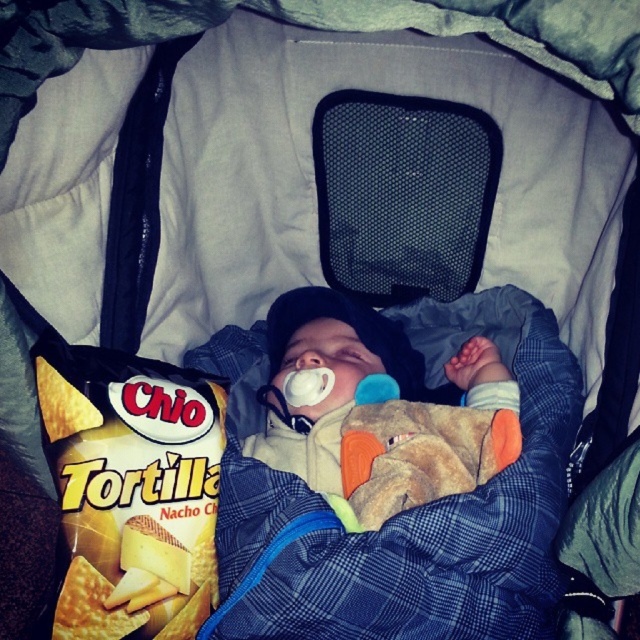
Which is behind, point (93, 484) or point (412, 433)?

Point (412, 433)

Measure the distance from yellow tortilla chips at lower left to blue rubber teething ring at upper center.

yellow tortilla chips at lower left is 13.68 inches away from blue rubber teething ring at upper center.

This screenshot has height=640, width=640. What do you see at coordinates (132, 490) in the screenshot?
I see `yellow tortilla chips at lower left` at bounding box center [132, 490].

Locate an element on the screen. yellow tortilla chips at lower left is located at coordinates (132, 490).

Can you confirm if soft plush toy at center is positioned to the left of blue rubber teething ring at upper center?

Yes, soft plush toy at center is to the left of blue rubber teething ring at upper center.

Consider the image. Is soft plush toy at center above blue rubber teething ring at upper center?

Yes.

Does point (506, 413) come closer to viewer compared to point (390, 448)?

Yes, it is in front of point (390, 448).

This screenshot has width=640, height=640. What are the coordinates of `soft plush toy at center` in the screenshot? It's located at coord(378,410).

Who is taller, yellow tortilla chips at lower left or soft plush toy at center?

yellow tortilla chips at lower left is taller.

Is yellow tortilla chips at lower left bigger than soft plush toy at center?

No, yellow tortilla chips at lower left is not bigger than soft plush toy at center.

Where is `yellow tortilla chips at lower left`? Image resolution: width=640 pixels, height=640 pixels. yellow tortilla chips at lower left is located at coordinates (132, 490).

Locate an element on the screen. Image resolution: width=640 pixels, height=640 pixels. yellow tortilla chips at lower left is located at coordinates (132, 490).